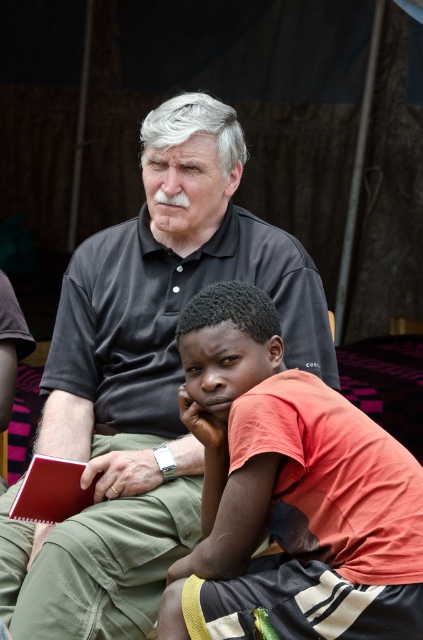
Question: Which point is farther from the camera taking this photo?

Choices:
 (A) (222, 193)
 (B) (255, 380)

Answer: (A)

Question: In this image, where is black matte shirt at center located relative to orange cotton shirt at center?

Choices:
 (A) below
 (B) above

Answer: (B)

Question: Is black matte shirt at center bigger than orange cotton shirt at center?

Choices:
 (A) yes
 (B) no

Answer: (A)

Question: Where is black matte shirt at center located in relation to orange cotton shirt at center in the image?

Choices:
 (A) right
 (B) left

Answer: (B)